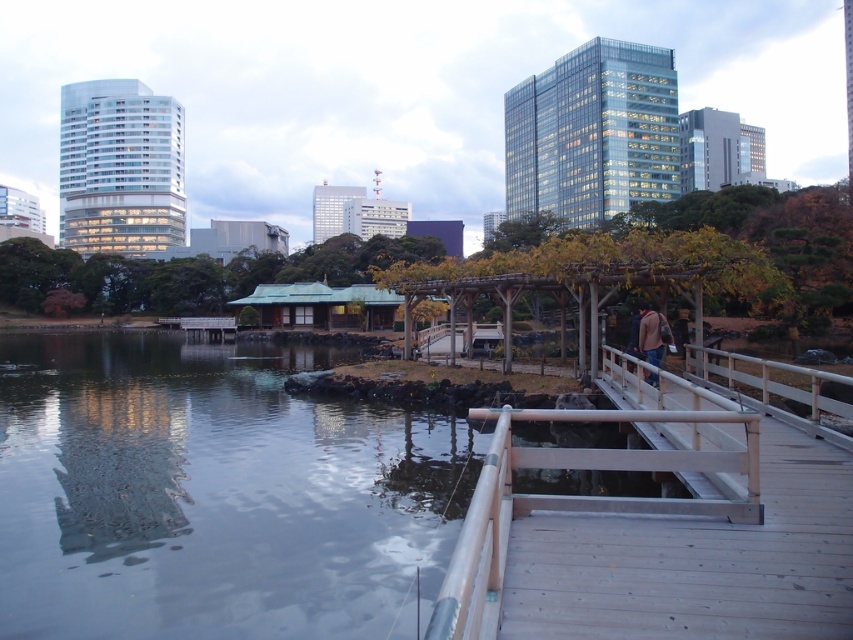
Does light brown wooden dock at center lie in front of brown leather jacket at center-right?

Yes, light brown wooden dock at center is closer to the viewer.

Is light brown wooden dock at center to the left of brown leather jacket at center-right from the viewer's perspective?

Indeed, light brown wooden dock at center is positioned on the left side of brown leather jacket at center-right.

Describe the element at coordinates (654, 531) in the screenshot. I see `light brown wooden dock at center` at that location.

Image resolution: width=853 pixels, height=640 pixels. Find the location of `light brown wooden dock at center`. light brown wooden dock at center is located at coordinates (654, 531).